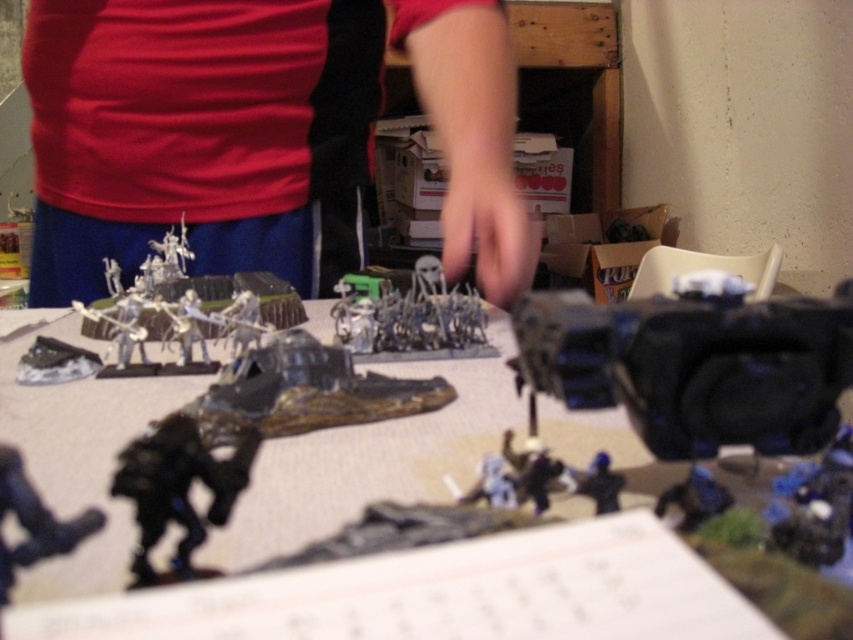
Which is more to the right, satin silver miniature army at center or shiny black figure at lower left?

satin silver miniature army at center is more to the right.

Between point (408, 280) and point (25, 529), which one is positioned in front?

Point (25, 529) is more forward.

Is point (347, 282) behind point (9, 499)?

Yes, it is behind point (9, 499).

Identify the location of satin silver miniature army at center. Image resolution: width=853 pixels, height=640 pixels. (409, 314).

Between white plastic miniature soldiers at center and shiny metallic tank at center, which one is positioned higher?

white plastic miniature soldiers at center is higher up.

Between point (281, 216) and point (318, 376), which one is positioned in front?

Point (318, 376)

Locate an element on the screen. The width and height of the screenshot is (853, 640). white plastic miniature soldiers at center is located at coordinates (183, 292).

Locate an element on the screen. white plastic miniature soldiers at center is located at coordinates (183, 292).

Which is more to the right, shiny metallic tank at center or blue plastic toy at center?

From the viewer's perspective, blue plastic toy at center appears more on the right side.

The image size is (853, 640). In order to click on shiny metallic tank at center in this screenshot , I will do `click(305, 392)`.